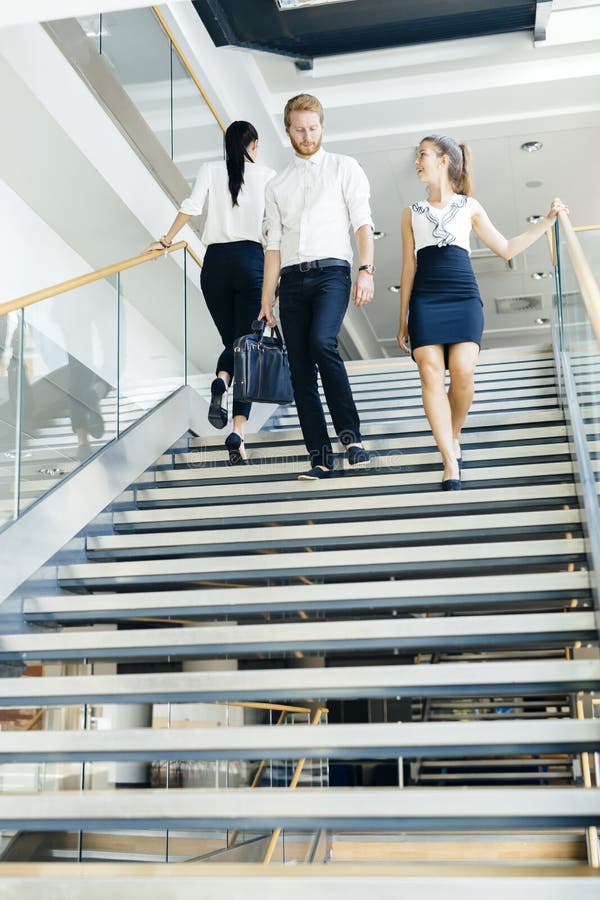
The image size is (600, 900). Find the location of `recessed lighting`. recessed lighting is located at coordinates [x=398, y=289], [x=378, y=232], [x=532, y=145], [x=536, y=216], [x=540, y=272], [x=544, y=317].